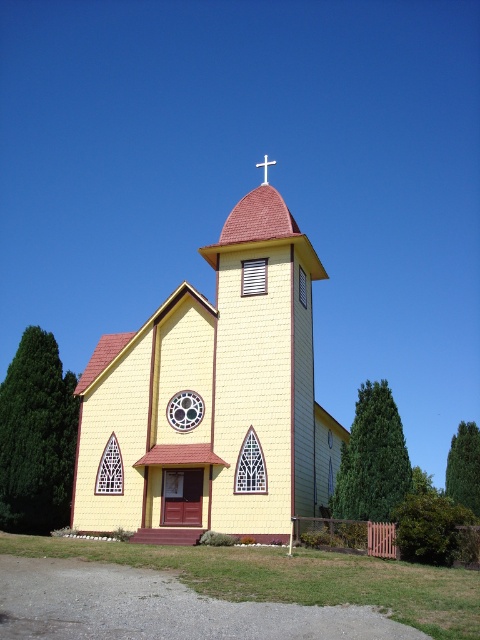
Locate an element on the screen. The image size is (480, 640). yellow wood chapel at center is located at coordinates (213, 397).

Does point (228, 397) come behind point (178, 394)?

No, (228, 397) is in front of (178, 394).

Find the location of `yellow wood chapel at center`. yellow wood chapel at center is located at coordinates (213, 397).

Can you confirm if yellow wood chapel at center is shorter than white metallic cross at upper center?

No, yellow wood chapel at center is not shorter than white metallic cross at upper center.

The height and width of the screenshot is (640, 480). Describe the element at coordinates (213, 397) in the screenshot. I see `yellow wood chapel at center` at that location.

Is point (156, 388) more distant than point (259, 164)?

No.

Identify the location of yellow wood chapel at center. (213, 397).

Which of these two, metallic circular clock at center or white metallic cross at upper center, stands taller?

white metallic cross at upper center is taller.

Does point (182, 420) come in front of point (265, 168)?

Yes, it is in front of point (265, 168).

Locate an element on the screen. The width and height of the screenshot is (480, 640). metallic circular clock at center is located at coordinates (184, 410).